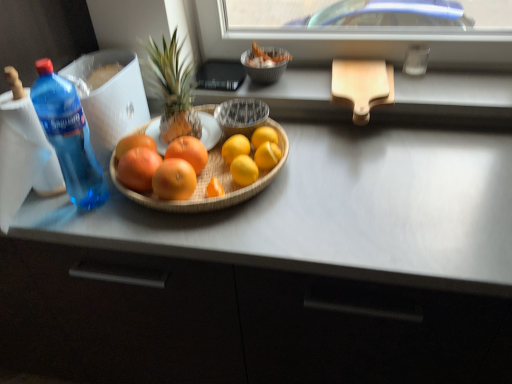
I want to click on free space to the right of orange matte grapefruit at center, arranged as the 3th grapefruit when viewed from the left, so click(250, 207).